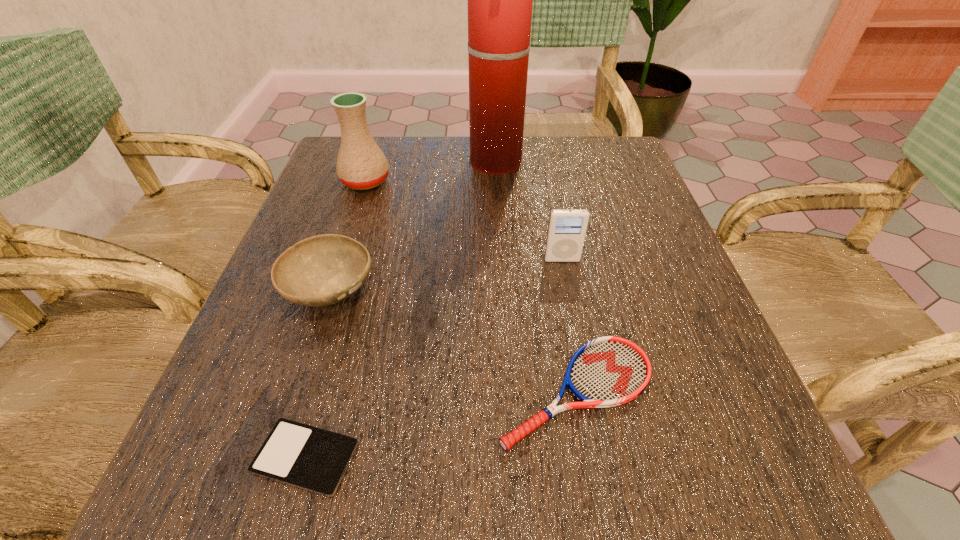
What are the coordinates of `vacant area that lies between the third shortest object and the fifth shortest object` in the screenshot? It's located at (348, 235).

Where is `vacant space in between the left iPod and the fire extinguisher`? vacant space in between the left iPod and the fire extinguisher is located at coordinates coord(401,310).

Find the location of a particular element. blank region between the fire extinguisher and the farther iPod is located at coordinates (529, 211).

Find the location of `blank region between the fifth tallest object and the bowl`. blank region between the fifth tallest object and the bowl is located at coordinates (453, 340).

The width and height of the screenshot is (960, 540). Identify the location of empty space that is in between the fire extinguisher and the left iPod. (401, 310).

Identify the location of object that is the fourth closest one to the fourth tallest object. The height and width of the screenshot is (540, 960). (500, 0).

Locate an element on the screen. object that is the second closest to the shorter iPod is located at coordinates (608, 371).

At what (x,y) coordinates should I click in order to perform the action: click on vacant space that satisfies the following two spatial constraints: 1. on the front side of the bowl; 2. on the left side of the pottery. Please return your answer as a coordinate pair (x, y). Looking at the image, I should click on (329, 289).

This screenshot has height=540, width=960. In order to click on vacant area that satisfies the following two spatial constraints: 1. with the nozzle and gauge on the second shortest object; 2. on the right side of the fire extinguisher in this screenshot , I will do `click(507, 392)`.